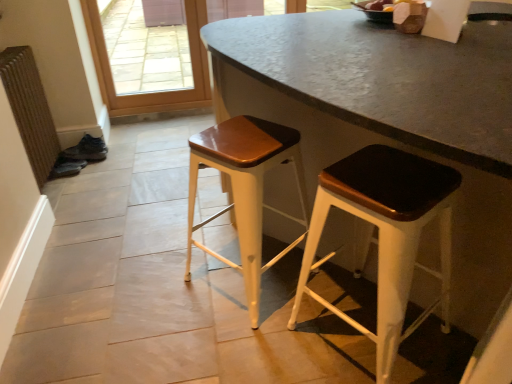
Question: Considering the relative sizes of brown textured radiator at left and wooden seat stool at center, the 1th stool when ordered from left to right, in the image provided, is brown textured radiator at left taller than wooden seat stool at center, the 1th stool when ordered from left to right,?

Choices:
 (A) yes
 (B) no

Answer: (A)

Question: Is brown textured radiator at left with wooden seat stool at center, acting as the 2th stool starting from the right?

Choices:
 (A) yes
 (B) no

Answer: (B)

Question: Considering the relative sizes of brown textured radiator at left and wooden seat stool at center, the 1th stool when ordered from left to right, in the image provided, is brown textured radiator at left thinner than wooden seat stool at center, the 1th stool when ordered from left to right,?

Choices:
 (A) no
 (B) yes

Answer: (B)

Question: Is the position of brown textured radiator at left less distant than that of wooden seat stool at center, the 1th stool when ordered from left to right?

Choices:
 (A) yes
 (B) no

Answer: (B)

Question: Is brown textured radiator at left positioned beyond the bounds of wooden seat stool at center, the 1th stool when ordered from left to right?

Choices:
 (A) yes
 (B) no

Answer: (A)

Question: Looking at the image, does matte black stool at center, the 2th stool positioned from the left, seem bigger or smaller compared to brown textured radiator at left?

Choices:
 (A) small
 (B) big

Answer: (B)

Question: Based on their positions, is matte black stool at center, which is counted as the first stool, starting from the right, located to the left or right of brown textured radiator at left?

Choices:
 (A) right
 (B) left

Answer: (A)

Question: From the image's perspective, relative to brown textured radiator at left, is matte black stool at center, which is counted as the first stool, starting from the right, above or below?

Choices:
 (A) above
 (B) below

Answer: (B)

Question: Considering the positions of matte black stool at center, the 2th stool positioned from the left, and brown textured radiator at left in the image, is matte black stool at center, the 2th stool positioned from the left, wider or thinner than brown textured radiator at left?

Choices:
 (A) wide
 (B) thin

Answer: (A)

Question: From a real-world perspective, is wooden seat stool at center, acting as the 2th stool starting from the right, positioned above or below brown textured radiator at left?

Choices:
 (A) above
 (B) below

Answer: (B)

Question: Relative to brown textured radiator at left, is wooden seat stool at center, the 1th stool when ordered from left to right, in front or behind?

Choices:
 (A) front
 (B) behind

Answer: (A)

Question: Is point (305, 193) closer or farther from the camera than point (53, 130)?

Choices:
 (A) farther
 (B) closer

Answer: (B)

Question: Is wooden seat stool at center, acting as the 2th stool starting from the right, taller or shorter than brown textured radiator at left?

Choices:
 (A) tall
 (B) short

Answer: (B)

Question: In terms of width, does wooden seat stool at center, the 1th stool when ordered from left to right, look wider or thinner when compared to matte black stool at center, which is counted as the first stool, starting from the right?

Choices:
 (A) thin
 (B) wide

Answer: (B)

Question: From the image's perspective, relative to matte black stool at center, the 2th stool positioned from the left, is wooden seat stool at center, the 1th stool when ordered from left to right, above or below?

Choices:
 (A) above
 (B) below

Answer: (A)